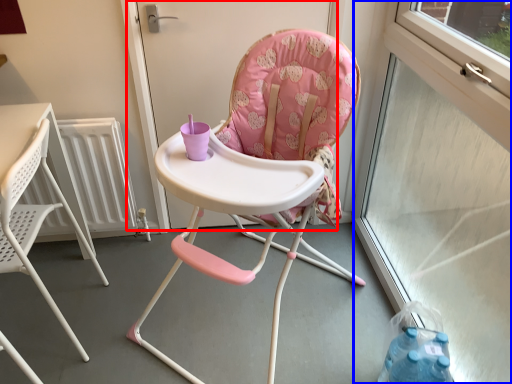
Question: Which of the following is the closest to the observer, screen door (highlighted by a red box) or window screen (highlighted by a blue box)?

Choices:
 (A) screen door
 (B) window screen

Answer: (B)